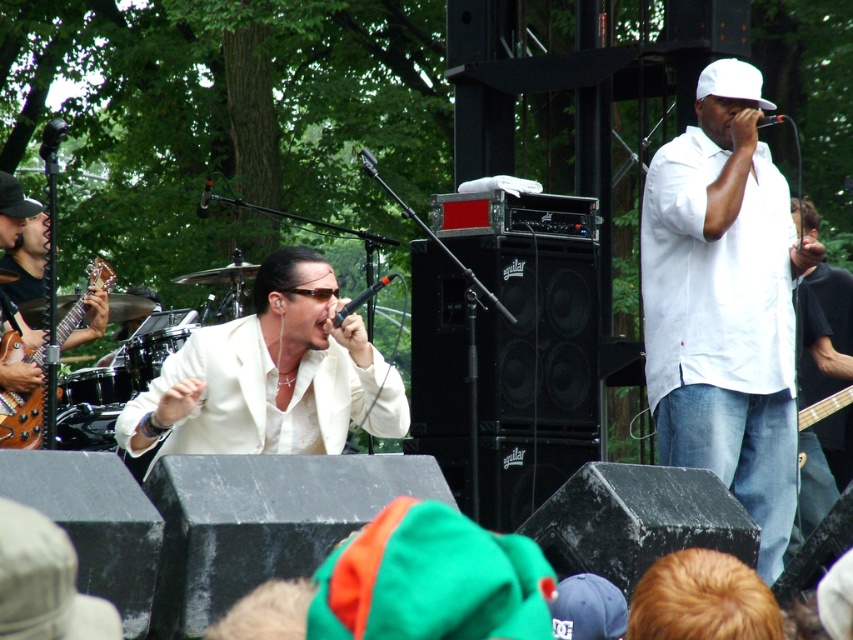
Question: Which of the following is the farthest from the observer?

Choices:
 (A) (76, 317)
 (B) (708, 461)

Answer: (A)

Question: Which of the following is the farthest from the observer?

Choices:
 (A) white matte shirt at upper right
 (B) wooden electric guitar at left
 (C) white glossy suit at center

Answer: (B)

Question: Can you confirm if white glossy suit at center is smaller than wooden electric guitar at left?

Choices:
 (A) yes
 (B) no

Answer: (B)

Question: In this image, where is white matte shirt at upper right located relative to wooden electric guitar at left?

Choices:
 (A) above
 (B) below

Answer: (A)

Question: Estimate the real-world distances between objects in this image. Which object is farther from the wooden electric guitar at left?

Choices:
 (A) white matte shirt at upper right
 (B) white glossy suit at center

Answer: (A)

Question: Is white matte shirt at upper right to the right of wooden electric guitar at left from the viewer's perspective?

Choices:
 (A) no
 (B) yes

Answer: (B)